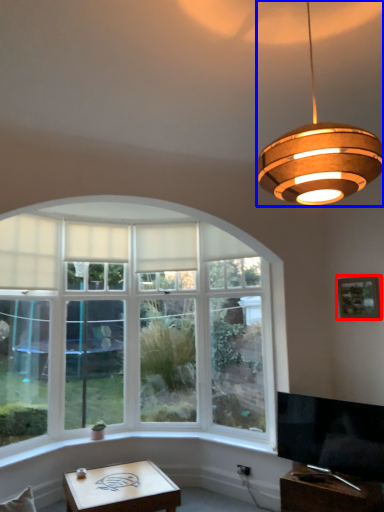
Question: Which of the following is the closest to the observer, picture frame (highlighted by a red box) or lamp (highlighted by a blue box)?

Choices:
 (A) picture frame
 (B) lamp

Answer: (B)